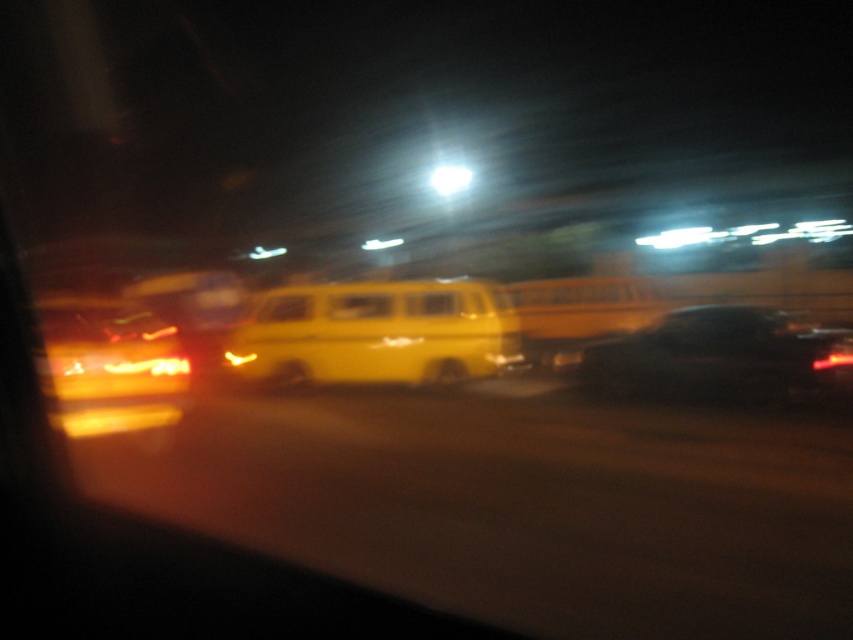
Question: Which object is the closest to the matte yellow van at center?

Choices:
 (A) yellow matte van at center
 (B) black glossy car at right

Answer: (A)

Question: Is yellow matte van at center wider than black glossy car at right?

Choices:
 (A) no
 (B) yes

Answer: (B)

Question: From the image, what is the correct spatial relationship of black glossy car at right in relation to matte yellow van at center?

Choices:
 (A) above
 (B) below

Answer: (A)

Question: Is yellow matte van at center thinner than black glossy car at right?

Choices:
 (A) no
 (B) yes

Answer: (A)

Question: Among these objects, which one is farthest from the camera?

Choices:
 (A) yellow matte van at center
 (B) matte yellow van at center
 (C) black glossy car at right

Answer: (A)

Question: Which object is closer to the camera taking this photo?

Choices:
 (A) black glossy car at right
 (B) matte yellow van at center
 (C) yellow matte van at center

Answer: (B)